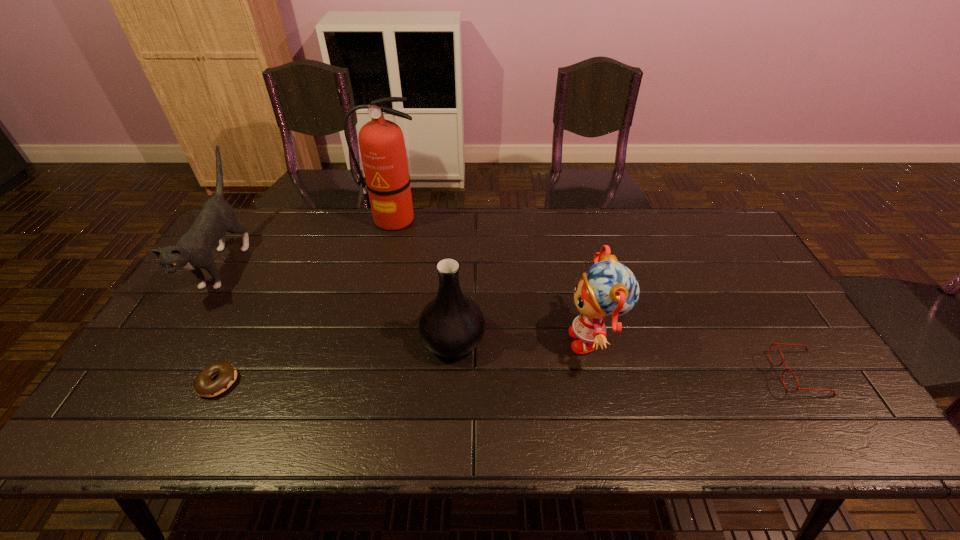
You are a GUI agent. You are given a task and a screenshot of the screen. Output one action in this format:
    pyautogui.click(x=<x>, y=<y>)
    Task: Click on the free space located at the face of the leftmost object
    The height and width of the screenshot is (540, 960).
    Given the screenshot: What is the action you would take?
    click(116, 438)

Locate an element on the screen. The height and width of the screenshot is (540, 960). vacant space located 0.250m on the back of the third object from right to left is located at coordinates (458, 256).

You are a GUI agent. You are given a task and a screenshot of the screen. Output one action in this format:
    pyautogui.click(x=<x>, y=<y>)
    Task: Click on the free region located on the face of the doll
    Image resolution: width=960 pixels, height=540 pixels.
    Given the screenshot: What is the action you would take?
    pyautogui.click(x=419, y=340)

Find the location of a particular element. The width and height of the screenshot is (960, 540). free space located 0.150m on the face of the doll is located at coordinates (509, 340).

Locate an element on the screen. The width and height of the screenshot is (960, 540). vacant space situated 0.120m on the face of the doll is located at coordinates (520, 340).

This screenshot has width=960, height=540. In order to click on vacant space located 0.330m on the face of the second shortest object in this screenshot , I will do `click(644, 374)`.

I want to click on free spot located 0.270m on the face of the second shortest object, so click(x=668, y=374).

This screenshot has width=960, height=540. What are the coordinates of `vacant space located on the face of the second shortest object` in the screenshot? It's located at click(696, 374).

You are a GUI agent. You are given a task and a screenshot of the screen. Output one action in this format:
    pyautogui.click(x=<x>, y=<y>)
    Task: Click on the vacant space located 0.290m on the right of the doughnut
    Image resolution: width=960 pixels, height=540 pixels.
    Given the screenshot: What is the action you would take?
    pyautogui.click(x=356, y=382)

Where is `fire extinguisher at the far edge`? The height and width of the screenshot is (540, 960). fire extinguisher at the far edge is located at coordinates (382, 147).